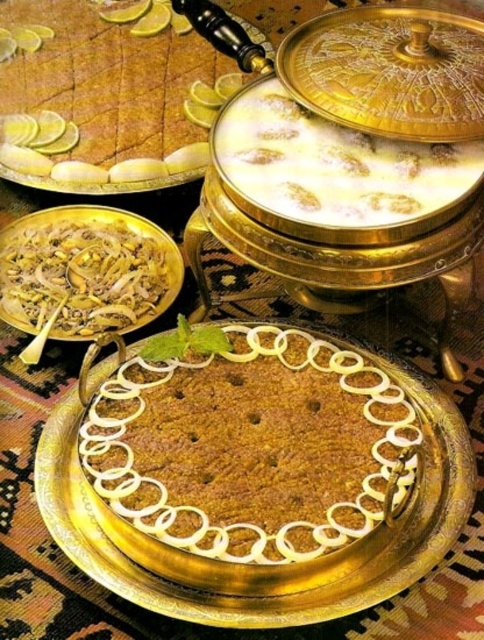
Question: Is brown crumbly cake at center positioned behind white creamy dessert at center?

Choices:
 (A) yes
 (B) no

Answer: (B)

Question: Is brown crumbly cake at center to the right of golden textured cake at center from the viewer's perspective?

Choices:
 (A) no
 (B) yes

Answer: (B)

Question: Among these objects, which one is nearest to the camera?

Choices:
 (A) white creamy rice at center
 (B) brown crumbly cake at center

Answer: (B)

Question: Estimate the real-world distances between objects in this image. Which object is farther from the white creamy dessert at center?

Choices:
 (A) golden textured cake at center
 (B) brown crumbly cake at center
 (C) white creamy rice at center

Answer: (A)

Question: Observing the image, what is the correct spatial positioning of brown crumbly cake at center in reference to white creamy rice at center?

Choices:
 (A) below
 (B) above

Answer: (A)

Question: Which object is farther from the camera taking this photo?

Choices:
 (A) white creamy rice at center
 (B) white creamy dessert at center
 (C) golden textured cake at center
 (D) brown crumbly cake at center

Answer: (C)